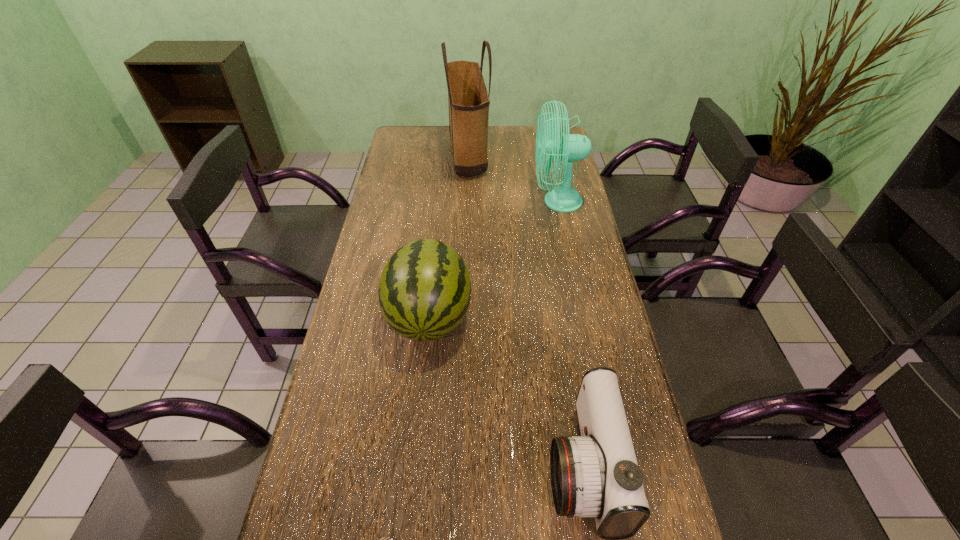
Find the location of a particular element. The width and height of the screenshot is (960, 540). vacant point that satisfies the following two spatial constraints: 1. in front of the second tallest object to blow air; 2. at the stem end of the watermelon is located at coordinates (581, 316).